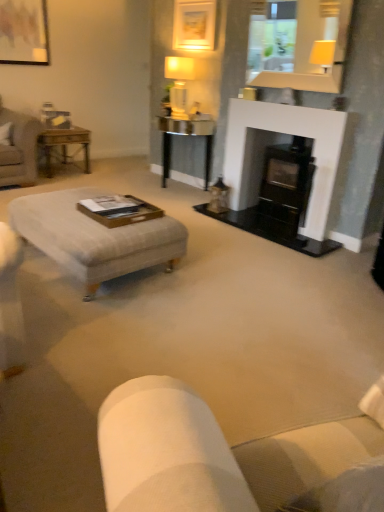
Question: Considering their positions, is metallic gold table at left, marked as the 2th table in a right-to-left arrangement, located in front of or behind matte glass mirror at upper center?

Choices:
 (A) behind
 (B) front

Answer: (A)

Question: Does point (54, 133) appear closer or farther from the camera than point (334, 11)?

Choices:
 (A) farther
 (B) closer

Answer: (A)

Question: Which is farther from the metallic gold table at left, marked as the first table in a left-to-right arrangement?

Choices:
 (A) matte wooden picture frame at upper left, placed as the 1th picture frame when sorted from left to right
 (B) matte gold picture frame at upper center, placed as the 2th picture frame when sorted from left to right
 (C) light gray fabric ottoman at center
 (D) white matte fireplace at center
 (E) metallic glass table at center, positioned as the second table in left-to-right order

Answer: (C)

Question: Considering the real-world distances, which object is closest to the light gray fabric ottoman at center?

Choices:
 (A) metallic glass table at center, the 1th table positioned from the right
 (B) matte wooden picture frame at upper left, placed as the 1th picture frame when sorted from left to right
 (C) matte white lamp at upper center
 (D) matte glass mirror at upper center
 (E) metallic gold table at left, marked as the first table in a left-to-right arrangement

Answer: (D)